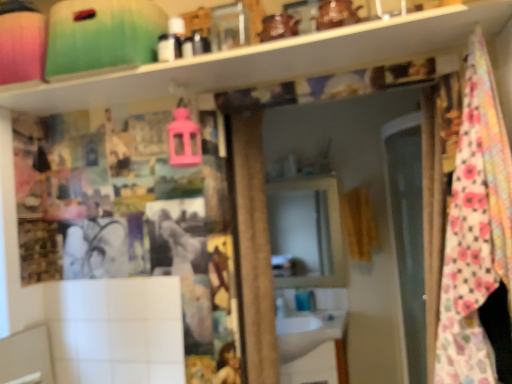
Question: Would you consider yellow fabric curtain at right to be distant from matte black toiletries at upper center?

Choices:
 (A) yes
 (B) no

Answer: (A)

Question: Can you confirm if yellow fabric curtain at right is thinner than matte black toiletries at upper center?

Choices:
 (A) yes
 (B) no

Answer: (B)

Question: Is matte black toiletries at upper center surrounded by yellow fabric curtain at right?

Choices:
 (A) no
 (B) yes

Answer: (A)

Question: Could you tell me if yellow fabric curtain at right is turned towards matte black toiletries at upper center?

Choices:
 (A) no
 (B) yes

Answer: (B)

Question: Can you confirm if yellow fabric curtain at right is shorter than matte black toiletries at upper center?

Choices:
 (A) yes
 (B) no

Answer: (B)

Question: Is the depth of yellow fabric curtain at right less than that of matte black toiletries at upper center?

Choices:
 (A) yes
 (B) no

Answer: (B)

Question: Considering the relative positions of white glossy sink at center and yellow fabric curtain at right in the image provided, is white glossy sink at center in front of yellow fabric curtain at right?

Choices:
 (A) no
 (B) yes

Answer: (B)

Question: From a real-world perspective, is white glossy sink at center located higher than yellow fabric curtain at right?

Choices:
 (A) no
 (B) yes

Answer: (A)

Question: From the image's perspective, would you say white glossy sink at center is shown under yellow fabric curtain at right?

Choices:
 (A) yes
 (B) no

Answer: (A)

Question: Considering the relative sizes of white glossy sink at center and yellow fabric curtain at right in the image provided, is white glossy sink at center thinner than yellow fabric curtain at right?

Choices:
 (A) no
 (B) yes

Answer: (A)

Question: Is white glossy sink at center to the left of yellow fabric curtain at right from the viewer's perspective?

Choices:
 (A) no
 (B) yes

Answer: (B)

Question: Does white glossy sink at center have a lesser height compared to yellow fabric curtain at right?

Choices:
 (A) yes
 (B) no

Answer: (A)

Question: From a real-world perspective, is blue glossy faucet at lower center below white glossy sink at center?

Choices:
 (A) yes
 (B) no

Answer: (B)